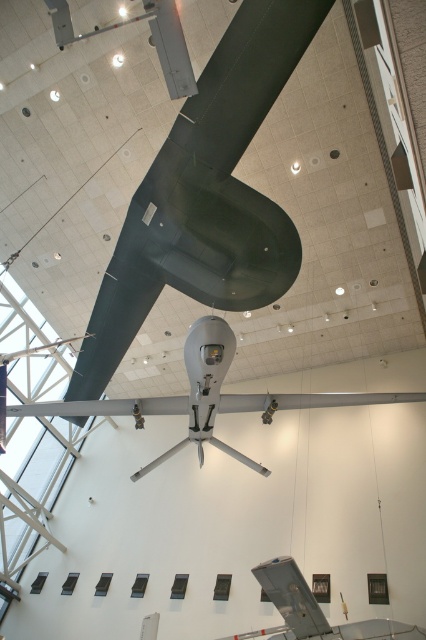
Is silver metallic drone at center to the left of metallic gray airplane at lower center from the viewer's perspective?

Yes, silver metallic drone at center is to the left of metallic gray airplane at lower center.

Is point (221, 353) farther from camera compared to point (276, 634)?

That is False.

Does point (58, 404) come behind point (396, 621)?

No, (58, 404) is closer to viewer.

This screenshot has height=640, width=426. Find the location of `silver metallic drone at center`. silver metallic drone at center is located at coordinates (206, 397).